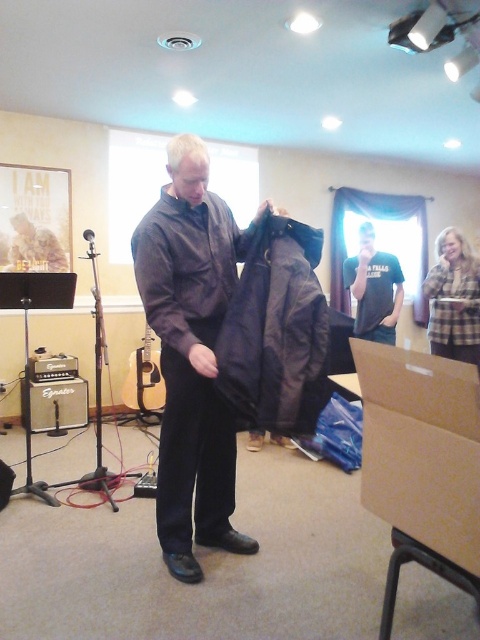
Question: Which point is farther to the camera?

Choices:
 (A) (443, 484)
 (B) (175, 440)
 (C) (362, 320)

Answer: (C)

Question: Can you confirm if brown cardboard box at lower right is thinner than dark matte jacket at center?

Choices:
 (A) no
 (B) yes

Answer: (B)

Question: Which point appears closest to the camera in this image?

Choices:
 (A) (372, 332)
 (B) (158, 388)
 (C) (384, 433)
 (D) (152, 253)

Answer: (C)

Question: Does matte black jacket at center appear over brown cardboard box at lower right?

Choices:
 (A) no
 (B) yes

Answer: (B)

Question: Which object is farther from the camera taking this photo?

Choices:
 (A) matte black jacket at center
 (B) black cotton t-shirt at center
 (C) leather jacket at center
 (D) dark matte jacket at center

Answer: (B)

Question: Does matte black jacket at center appear over black cotton t-shirt at center?

Choices:
 (A) yes
 (B) no

Answer: (B)